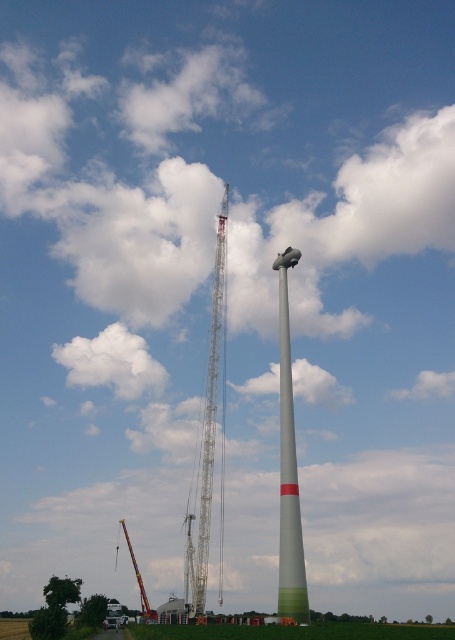
You are a construction worker observing the installation of the white matte wind turbine at center and the metallic lattice tower at center. Which object is positioned closer to your viewpoint?

The white matte wind turbine at center is closer to the viewer than the metallic lattice tower at center.

You are standing in front of the wind turbine installation site and want to determine the relative positions of two points marked in the image. Which point, point 1 at coordinates (283, 552) or point 2 at (202, 525), is closer to you?

Point 1 at coordinates (283, 552) is closer to the viewer than point 2 at (202, 525).

You are an engineer inspecting the wind turbine installation site. You need to determine which object is taller between the metallic lattice tower at center and the metallic gray crane at center. Based on the scene, which one is taller?

The metallic lattice tower at center is taller than the metallic gray crane at center according to the description.